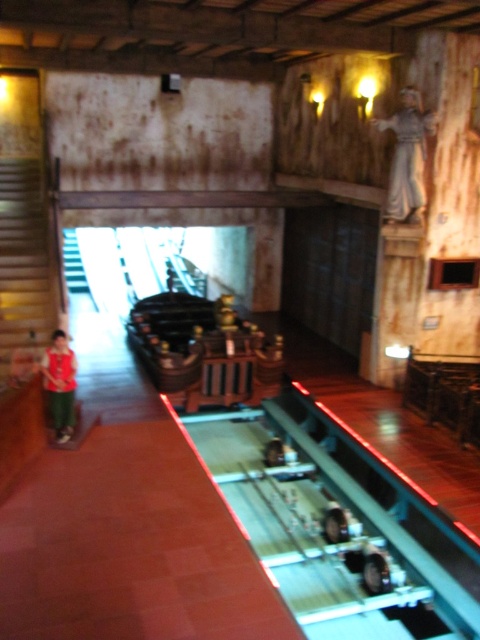
Question: Does wooden staircase at left come behind matte red shirt at left?

Choices:
 (A) no
 (B) yes

Answer: (B)

Question: Among these points, which one is nearest to the camera?

Choices:
 (A) (408, 138)
 (B) (38, 266)

Answer: (A)

Question: Estimate the real-world distances between objects in this image. Which object is farther from the matte red shirt at left?

Choices:
 (A) wooden staircase at left
 (B) white marble statue at upper right

Answer: (B)

Question: Does white marble statue at upper right have a greater width compared to matte red shirt at left?

Choices:
 (A) no
 (B) yes

Answer: (B)

Question: Can you confirm if wooden staircase at left is thinner than matte red shirt at left?

Choices:
 (A) no
 (B) yes

Answer: (A)

Question: Which point is closer to the camera?

Choices:
 (A) (406, 138)
 (B) (61, 348)

Answer: (B)